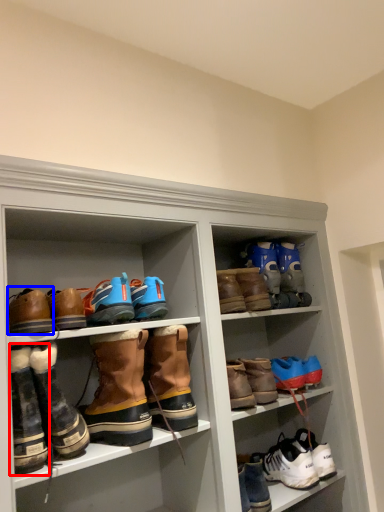
Question: Among these objects, which one is nearest to the camera, footwear (highlighted by a red box) or footwear (highlighted by a blue box)?

Choices:
 (A) footwear
 (B) footwear

Answer: (A)